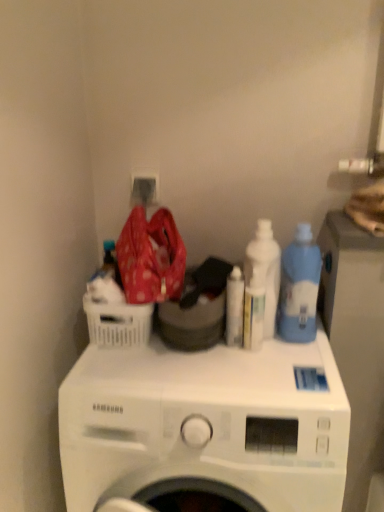
Question: Is the position of blue translucent bottle at right, placed as the third cleaning product when sorted from left to right, less distant than that of white matte washing machine at center?

Choices:
 (A) no
 (B) yes

Answer: (A)

Question: Considering the relative sizes of blue translucent bottle at right, placed as the first cleaning product when sorted from right to left, and white matte washing machine at center in the image provided, is blue translucent bottle at right, placed as the first cleaning product when sorted from right to left, thinner than white matte washing machine at center?

Choices:
 (A) yes
 (B) no

Answer: (A)

Question: Is blue translucent bottle at right, placed as the first cleaning product when sorted from right to left, directly adjacent to white matte washing machine at center?

Choices:
 (A) no
 (B) yes

Answer: (A)

Question: From a real-world perspective, is blue translucent bottle at right, placed as the first cleaning product when sorted from right to left, physically above white matte washing machine at center?

Choices:
 (A) yes
 (B) no

Answer: (A)

Question: Does blue translucent bottle at right, placed as the third cleaning product when sorted from left to right, have a greater width compared to white matte washing machine at center?

Choices:
 (A) no
 (B) yes

Answer: (A)

Question: In the image, is white glossy bottle at center, which is the third cleaning product from right to left, positioned in front of or behind white plastic basket at left?

Choices:
 (A) front
 (B) behind

Answer: (B)

Question: Is white glossy bottle at center, the 1th cleaning product when ordered from left to right, spatially inside white plastic basket at left, or outside of it?

Choices:
 (A) inside
 (B) outside

Answer: (B)

Question: Looking at the image, does white glossy bottle at center, which is the third cleaning product from right to left, seem bigger or smaller compared to white plastic basket at left?

Choices:
 (A) big
 (B) small

Answer: (B)

Question: Would you say white glossy bottle at center, the 1th cleaning product when ordered from left to right, is to the left or to the right of white plastic basket at left in the picture?

Choices:
 (A) left
 (B) right

Answer: (B)

Question: From a real-world perspective, is white glossy bottle at center, which is the third cleaning product from right to left, positioned above or below blue translucent bottle at right, placed as the first cleaning product when sorted from right to left?

Choices:
 (A) below
 (B) above

Answer: (A)

Question: Is white glossy bottle at center, the 1th cleaning product when ordered from left to right, bigger or smaller than blue translucent bottle at right, placed as the first cleaning product when sorted from right to left?

Choices:
 (A) big
 (B) small

Answer: (B)

Question: Looking at their shapes, would you say white glossy bottle at center, the 1th cleaning product when ordered from left to right, is wider or thinner than blue translucent bottle at right, placed as the first cleaning product when sorted from right to left?

Choices:
 (A) wide
 (B) thin

Answer: (B)

Question: Is white glossy bottle at center, the 1th cleaning product when ordered from left to right, inside or outside of blue translucent bottle at right, placed as the first cleaning product when sorted from right to left?

Choices:
 (A) outside
 (B) inside

Answer: (A)

Question: Considering the positions of white plastic basket at left and white glossy bottle at center, the 1th cleaning product when ordered from left to right, in the image, is white plastic basket at left bigger or smaller than white glossy bottle at center, the 1th cleaning product when ordered from left to right,?

Choices:
 (A) big
 (B) small

Answer: (A)

Question: Considering the relative positions of white plastic basket at left and white glossy bottle at center, the 1th cleaning product when ordered from left to right, in the image provided, is white plastic basket at left to the left or to the right of white glossy bottle at center, the 1th cleaning product when ordered from left to right,?

Choices:
 (A) left
 (B) right

Answer: (A)